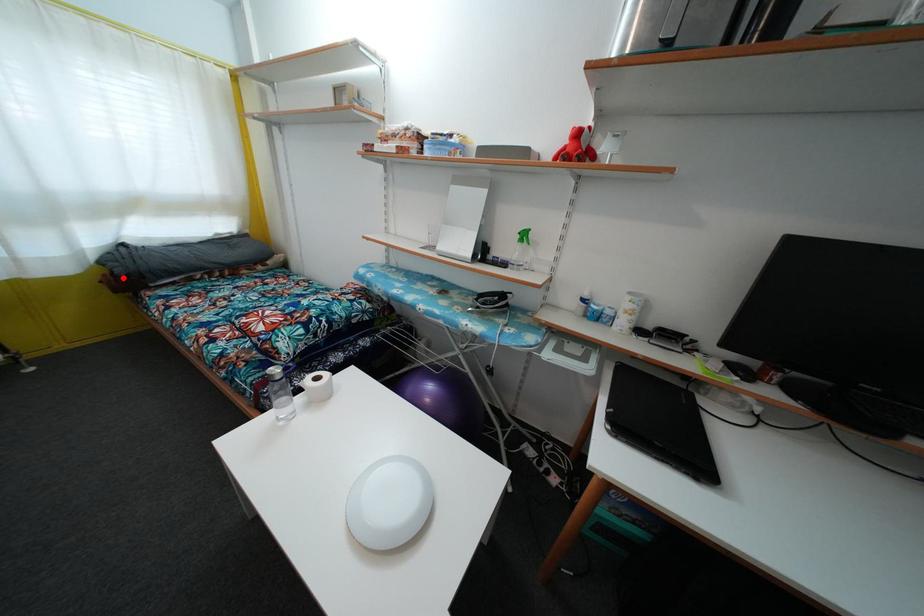
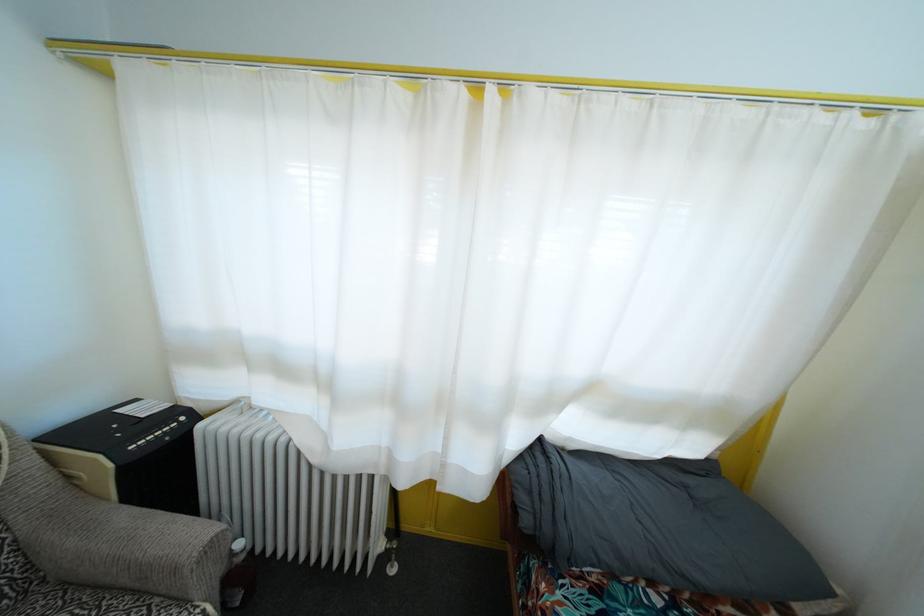
In the second image, find the point that corresponds to the highlighted location in the first image.

(529, 528)